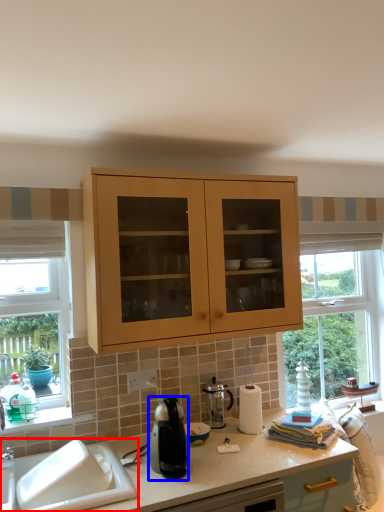
Question: Which point is further to the camera, sink (highlighted by a red box) or kitchen appliance (highlighted by a blue box)?

Choices:
 (A) sink
 (B) kitchen appliance

Answer: (B)